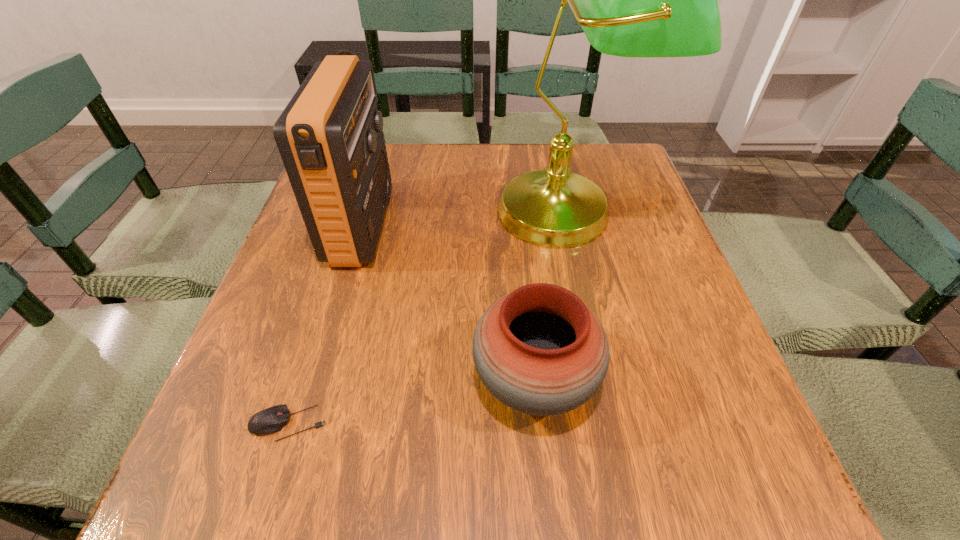
Locate which object ranks second in proximity to the second shortest object. Please provide its 2D coordinates. Your answer should be formatted as a tuple, i.e. [(x, y)], where the tuple contains the x and y coordinates of a point satisfying the conditions above.

[(271, 420)]

Identify which object is the second nearest to the mouse. Please provide its 2D coordinates. Your answer should be formatted as a tuple, i.e. [(x, y)], where the tuple contains the x and y coordinates of a point satisfying the conditions above.

[(330, 136)]

In order to click on free space that satisfies the following two spatial constraints: 1. on the front-facing side of the pottery; 2. on the right side of the radio receiver in this screenshot , I will do `click(317, 381)`.

The width and height of the screenshot is (960, 540). I want to click on vacant position in the image that satisfies the following two spatial constraints: 1. on the front-facing side of the third shortest object; 2. on the back side of the third tallest object, so click(x=317, y=381).

Identify the location of free space in the image that satisfies the following two spatial constraints: 1. on the front-facing side of the pottery; 2. on the left side of the second tallest object. The image size is (960, 540). point(317,381).